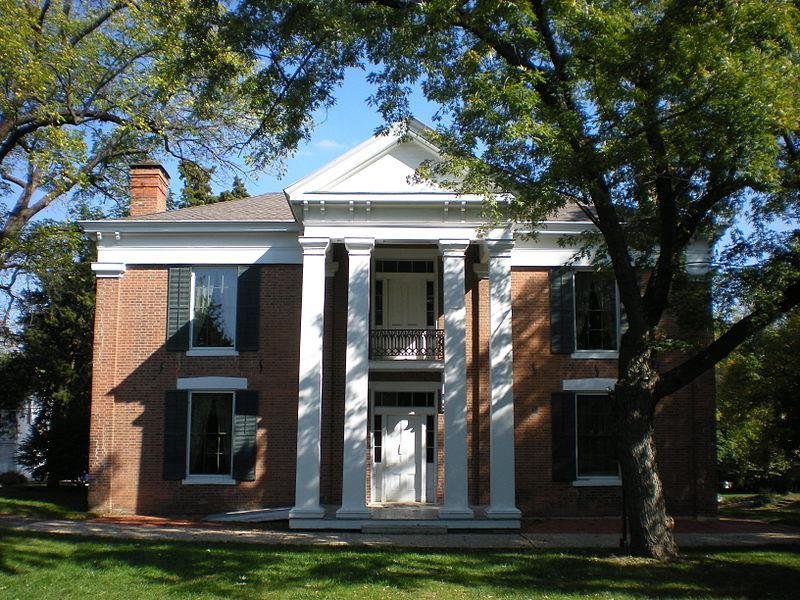
This screenshot has width=800, height=600. Find the location of `column`. column is located at coordinates (309, 389).